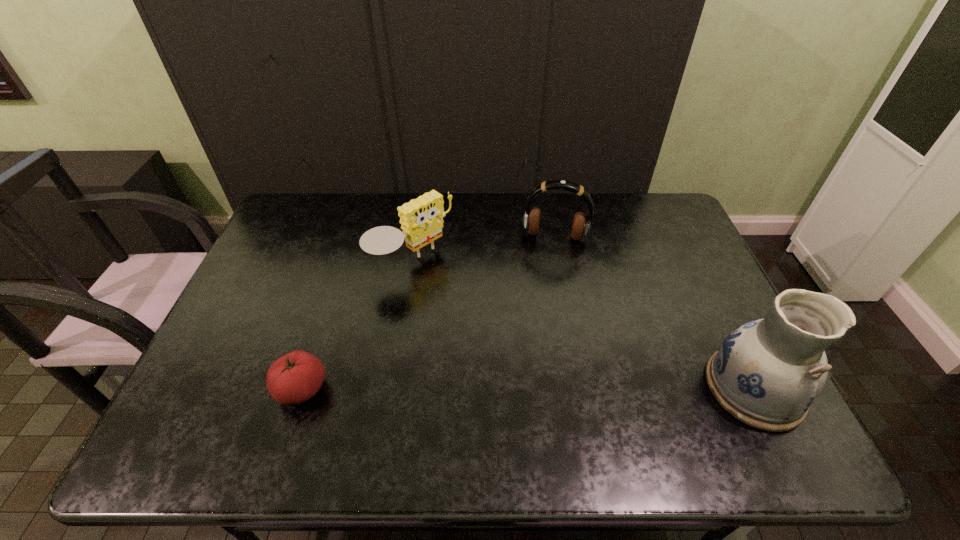
Where is `free spot at the near edge of the desktop`? The height and width of the screenshot is (540, 960). free spot at the near edge of the desktop is located at coordinates (560, 397).

This screenshot has height=540, width=960. In the image, there is a desktop. Find the location of `vacant region at the left edge`. vacant region at the left edge is located at coordinates (233, 349).

I want to click on vacant space at the near left corner of the desktop, so click(210, 402).

Identify the location of vacant space at the far right corner. Image resolution: width=960 pixels, height=540 pixels. (648, 207).

At what (x,y) coordinates should I click in order to perform the action: click on vacant area that lies between the headset and the leftmost object. Please return your answer as a coordinate pair (x, y). The height and width of the screenshot is (540, 960). Looking at the image, I should click on (428, 313).

You are a GUI agent. You are given a task and a screenshot of the screen. Output one action in this format:
    pyautogui.click(x=<x>, y=<y>)
    Task: Click on the free space between the tomato and the pottery
    
    Given the screenshot: What is the action you would take?
    528,388

Where is `free point between the shortest object and the third object from right to left`? The image size is (960, 540). free point between the shortest object and the third object from right to left is located at coordinates (357, 326).

Find the location of a particular element. The image size is (960, 540). free spot between the second object from left to right and the tomato is located at coordinates (357, 326).

You are a GUI agent. You are given a task and a screenshot of the screen. Output one action in this format:
    pyautogui.click(x=<x>, y=<y>)
    Task: Click on the vacant region between the sponge and the tallest object
    The width and height of the screenshot is (960, 540).
    Given the screenshot: What is the action you would take?
    pos(583,325)

At what (x,y) coordinates should I click in order to perform the action: click on free space between the tomato and the third object from right to left. Please return your answer as a coordinate pair (x, y). Looking at the image, I should click on (357, 326).